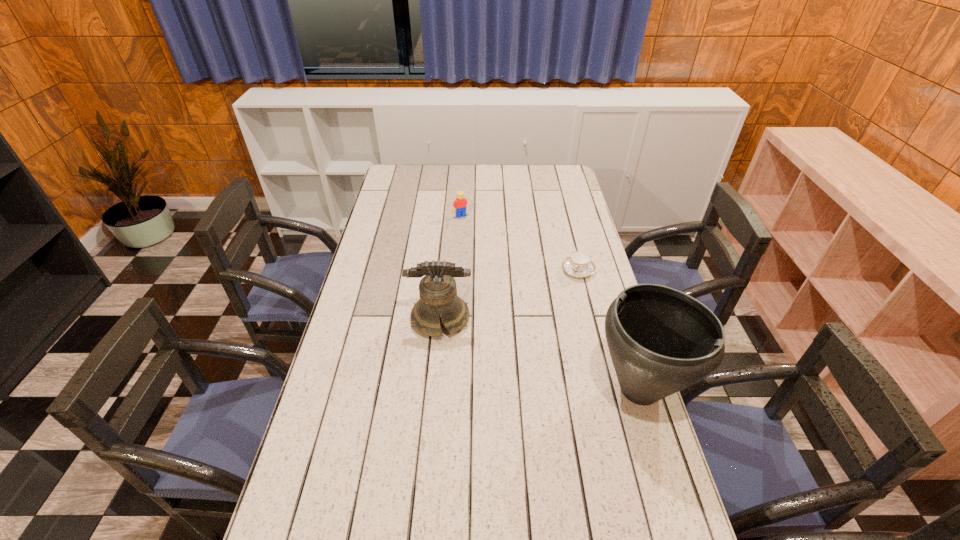
Locate an element on the screen. object that is the second closest to the urn is located at coordinates (438, 294).

Where is `free space that satisfies the following two spatial constraints: 1. on the front side of the urn; 2. on the right side of the teacup`? This screenshot has width=960, height=540. free space that satisfies the following two spatial constraints: 1. on the front side of the urn; 2. on the right side of the teacup is located at coordinates (608, 389).

I want to click on vacant position in the image that satisfies the following two spatial constraints: 1. on the back side of the third farthest object; 2. on the left side of the second farthest object, so click(x=444, y=271).

At what (x,y) coordinates should I click in order to perform the action: click on vacant area in the image that satisfies the following two spatial constraints: 1. on the back side of the teacup; 2. on the right side of the third farthest object. Please return your answer as a coordinate pair (x, y). Looking at the image, I should click on (444, 271).